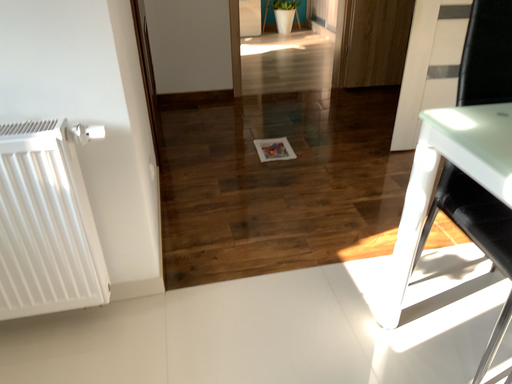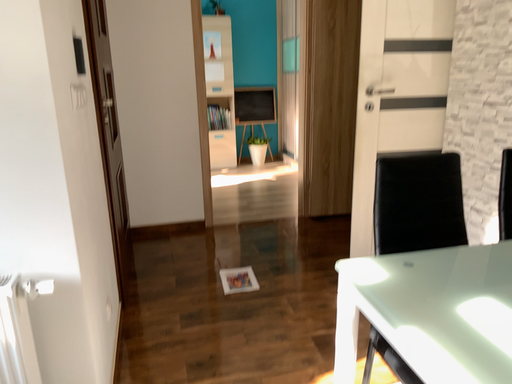
Question: Which way did the camera rotate in the video?

Choices:
 (A) rotated upward
 (B) rotated downward

Answer: (A)